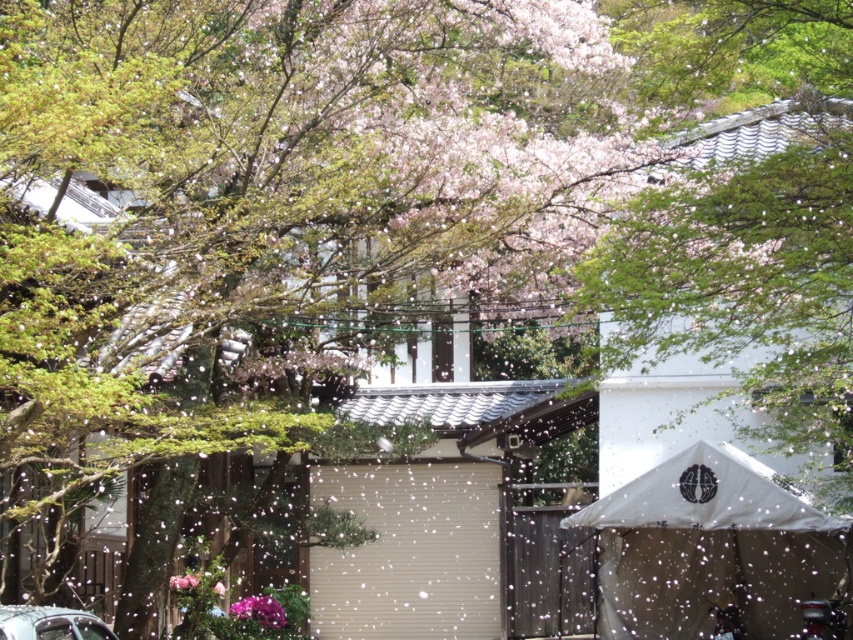
Question: Which object appears farthest from the camera in this image?

Choices:
 (A) pink matte flower at lower center
 (B) metallic silver car at lower left

Answer: (A)

Question: Estimate the real-world distances between objects in this image. Which object is farther from the metallic silver car at lower left?

Choices:
 (A) white canvas canopy at center
 (B) white fabric canopy at center
 (C) pink matte flower at lower center

Answer: (A)

Question: Which of the following is the closest to the observer?

Choices:
 (A) white fabric canopy at center
 (B) white canvas canopy at center
 (C) pink matte flower at lower center
 (D) metallic silver car at lower left

Answer: (D)

Question: Does white canvas canopy at center have a lesser width compared to white fabric canopy at center?

Choices:
 (A) yes
 (B) no

Answer: (B)

Question: Does white canvas canopy at center have a larger size compared to white fabric canopy at center?

Choices:
 (A) yes
 (B) no

Answer: (A)

Question: Can you confirm if white fabric canopy at center is smaller than metallic silver car at lower left?

Choices:
 (A) yes
 (B) no

Answer: (B)